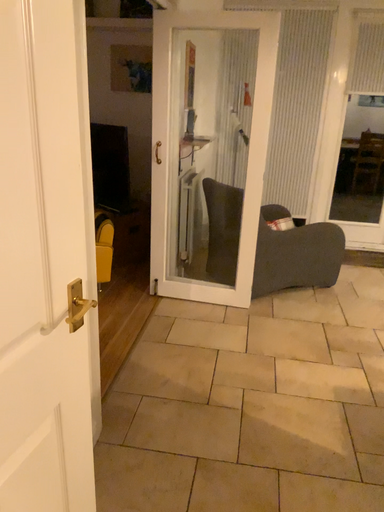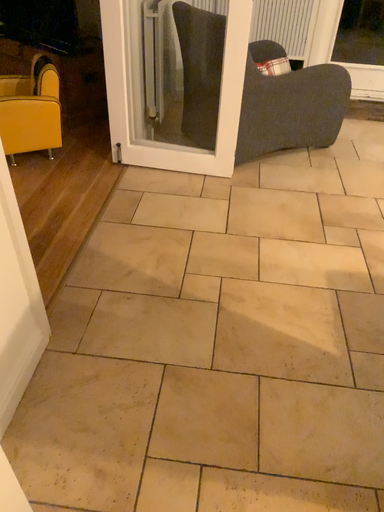
Question: Which way did the camera rotate in the video?

Choices:
 (A) rotated downward
 (B) rotated upward

Answer: (A)